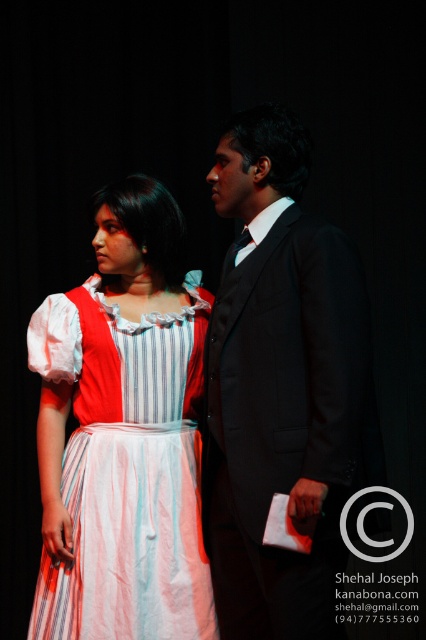
You are a photographer setting up for a photoshoot. You need to position a spotlight so that it can illuminate both the black satin suit at center and the striped cotton dress at center equally. Given their sizes, which object requires the spotlight to be placed closer to it to ensure proper illumination?

The black satin suit at center has a larger size compared to the striped cotton dress at center. To ensure both receive equal illumination, the spotlight should be placed closer to the striped cotton dress at center since it is smaller and requires less distance to adequately light.